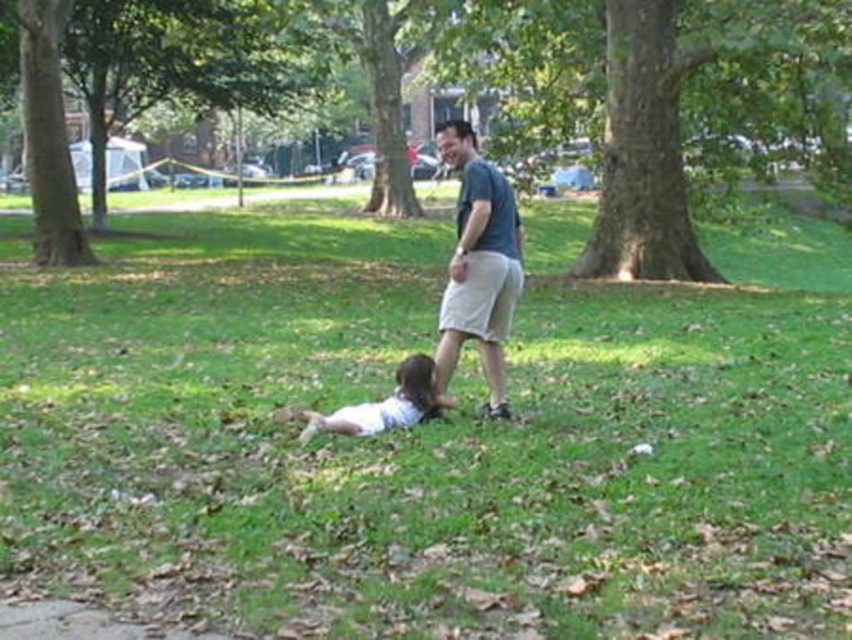
You are planning to set up a picnic blanket in the park. You want to choose a spot that is under the shade of both the green leafy tree at center and the green leafy tree at upper left. Is this possible?

The green leafy tree at center might be wider than green leafy tree at upper left, so it is possible that their shades overlap, allowing you to set up the picnic blanket under both.

You are standing at the origin point in the park scene. You see two points marked in the image. Which point is closer to you, point [485,257] or point [415,353]?

Point [485,257] is in front of point [415,353], so it is closer to you.

A man and a child are playing in a park. The man is standing upright facing the child who is lying on the ground. The green leafy tree at center is between them. If the distance between the man and the child is 13.31 meters, can a soccer ball kicked by the man reach the child?

The distance between the man and the child is 13.31 meters. A soccer ball kicked by an average adult can travel up to 30 meters, so yes, the ball can reach the child if kicked with sufficient force and in the right direction.